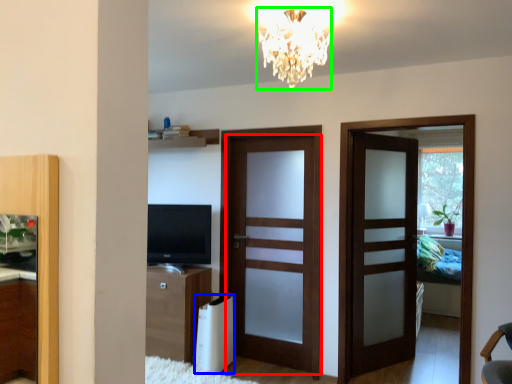
Question: Which is nearer to the door (highlighted by a red box)? appliance (highlighted by a blue box) or lamp (highlighted by a green box).

Choices:
 (A) appliance
 (B) lamp

Answer: (A)